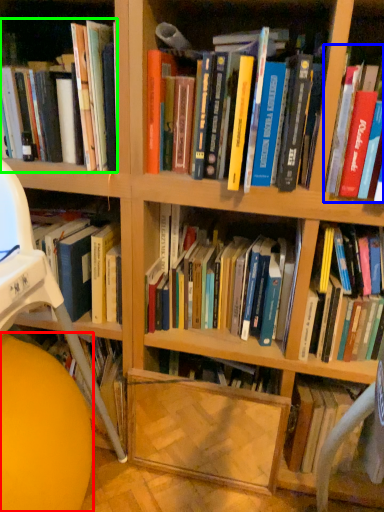
Question: Considering the real-world distances, which object is closest to ball (highlighted by a red box)? book (highlighted by a blue box) or book (highlighted by a green box).

Choices:
 (A) book
 (B) book

Answer: (B)